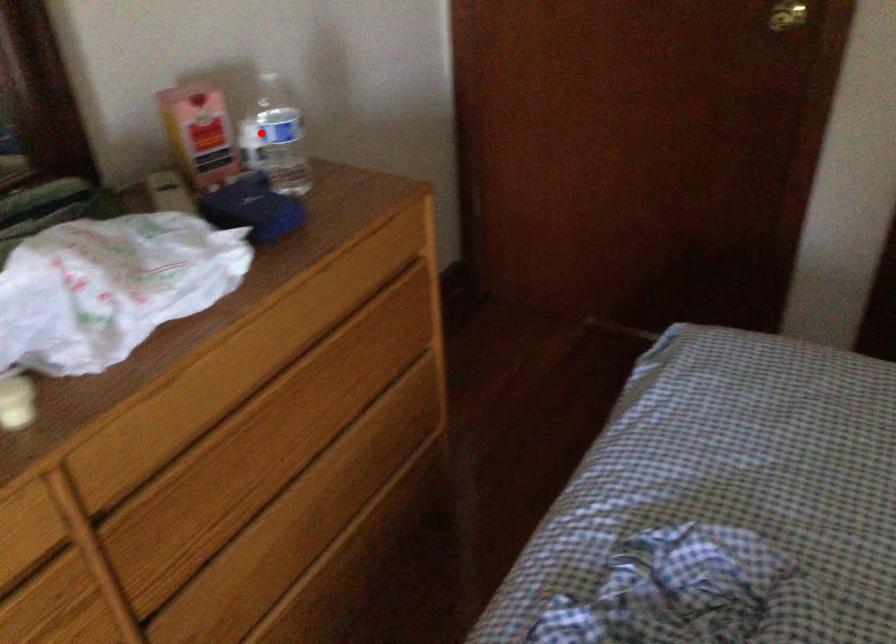
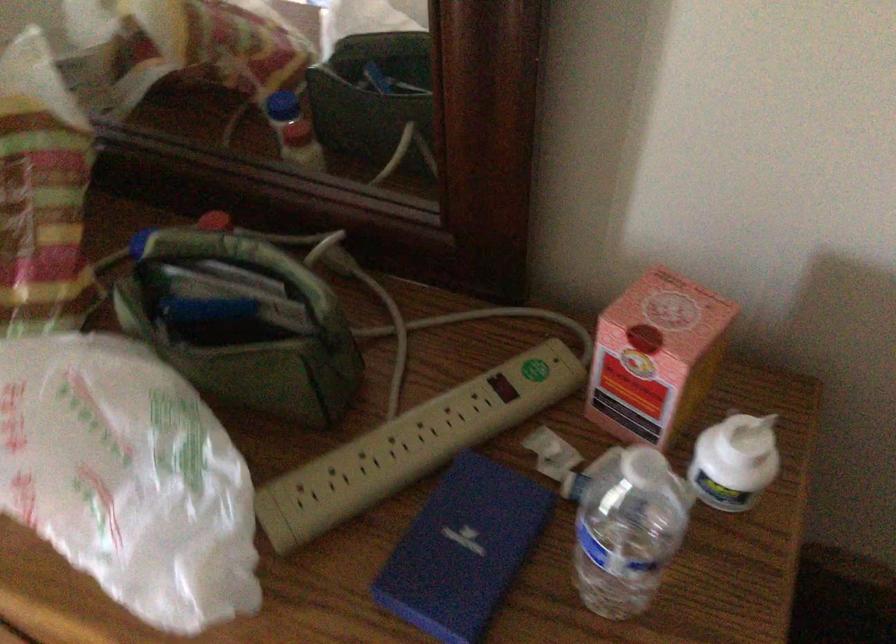
Question: A red point is marked in image1. In image2, is the corresponding 3D point closer to the camera or farther? Reply with the corresponding letter.

Choices:
 (A) The corresponding 3D point is closer.
 (B) The corresponding 3D point is farther.

Answer: (A)